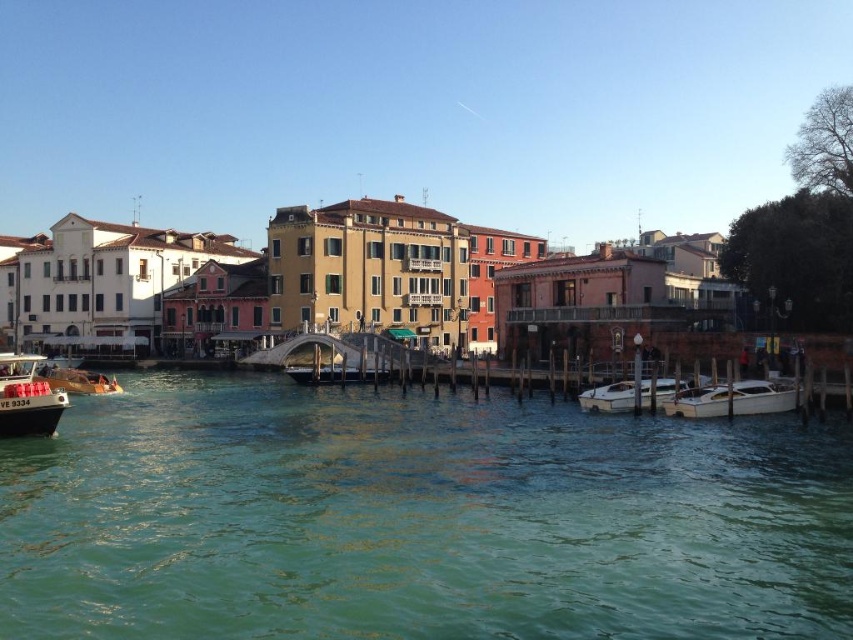
You are standing at the dock on the right side of the canal, looking towards the pedestrian bridge in the middle. There is a white glossy boat at lower center. Can you see the boat from your current position?

Yes, the white glossy boat at lower center is located at point coordinates of [608,397], which is within your line of sight from the dock on the right side of the canal.

Consider the image. You are standing on the pedestrian bridge in the middle ground and see the point at coordinates (732, 400). Which object is this point located on?

The point at coordinates (732, 400) is located on the white glossy boat at lower right.

You are a tour guide leading a group along the canal and want to board a boat that can accommodate more passengers. Based on the scene, which boat should you choose between the white glossy boat at lower center and the metallic gold boat at lower left?

The metallic gold boat at lower left has a greater width than the white glossy boat at lower center, so it can accommodate more passengers.